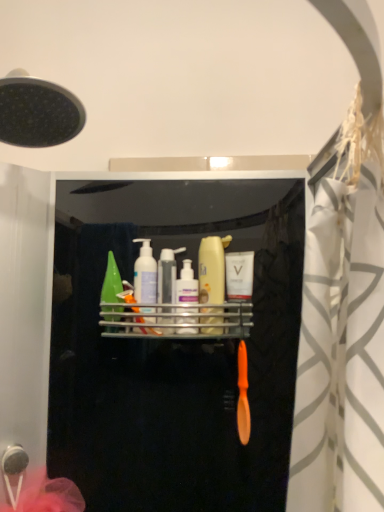
Question: Is white glossy mouthwash at center, positioned as the first mouthwash in right-to-left order, at the left side of metallic silver shelf at center?

Choices:
 (A) yes
 (B) no

Answer: (B)

Question: Are white glossy mouthwash at center, placed as the fifth mouthwash when sorted from left to right, and metallic silver shelf at center far apart?

Choices:
 (A) yes
 (B) no

Answer: (B)

Question: Does white glossy mouthwash at center, positioned as the first mouthwash in right-to-left order, touch metallic silver shelf at center?

Choices:
 (A) no
 (B) yes

Answer: (B)

Question: From a real-world perspective, is white glossy mouthwash at center, placed as the fifth mouthwash when sorted from left to right, on metallic silver shelf at center?

Choices:
 (A) no
 (B) yes

Answer: (B)

Question: Is white glossy mouthwash at center, placed as the fifth mouthwash when sorted from left to right, positioned with its back to metallic silver shelf at center?

Choices:
 (A) no
 (B) yes

Answer: (A)

Question: From a real-world perspective, is metallic silver shelf at center above or below white glossy mouthwash at center, placed as the fifth mouthwash when sorted from left to right?

Choices:
 (A) above
 (B) below

Answer: (B)

Question: From the image's perspective, is metallic silver shelf at center located above or below white glossy mouthwash at center, positioned as the first mouthwash in right-to-left order?

Choices:
 (A) above
 (B) below

Answer: (B)

Question: Considering their positions, is metallic silver shelf at center located in front of or behind white glossy mouthwash at center, placed as the fifth mouthwash when sorted from left to right?

Choices:
 (A) behind
 (B) front

Answer: (B)

Question: From their relative heights in the image, would you say metallic silver shelf at center is taller or shorter than white glossy mouthwash at center, placed as the fifth mouthwash when sorted from left to right?

Choices:
 (A) short
 (B) tall

Answer: (A)

Question: Is point (152, 276) closer or farther from the camera than point (241, 330)?

Choices:
 (A) closer
 (B) farther

Answer: (B)

Question: From the image's perspective, is translucent green bottle at center, marked as the 2th mouthwash in a left-to-right arrangement, above or below white glossy mouthwash at center, placed as the fifth mouthwash when sorted from left to right?

Choices:
 (A) above
 (B) below

Answer: (A)

Question: In terms of width, does translucent green bottle at center, the fourth mouthwash in the right-to-left sequence, look wider or thinner when compared to white glossy mouthwash at center, positioned as the first mouthwash in right-to-left order?

Choices:
 (A) wide
 (B) thin

Answer: (A)

Question: From a real-world perspective, is translucent green bottle at center, the fourth mouthwash in the right-to-left sequence, physically located above or below white glossy mouthwash at center, positioned as the first mouthwash in right-to-left order?

Choices:
 (A) above
 (B) below

Answer: (A)

Question: Considering the positions of translucent plastic mouthwash at center, positioned as the 2th mouthwash in right-to-left order, and translucent plastic mouthwash at center, which appears as the 3th mouthwash when viewed from the right, in the image, is translucent plastic mouthwash at center, positioned as the 2th mouthwash in right-to-left order, bigger or smaller than translucent plastic mouthwash at center, which appears as the 3th mouthwash when viewed from the right,?

Choices:
 (A) big
 (B) small

Answer: (A)

Question: Is translucent plastic mouthwash at center, positioned as the 2th mouthwash in right-to-left order, in front of or behind translucent plastic mouthwash at center, which appears as the 3th mouthwash when viewed from the right, in the image?

Choices:
 (A) front
 (B) behind

Answer: (A)